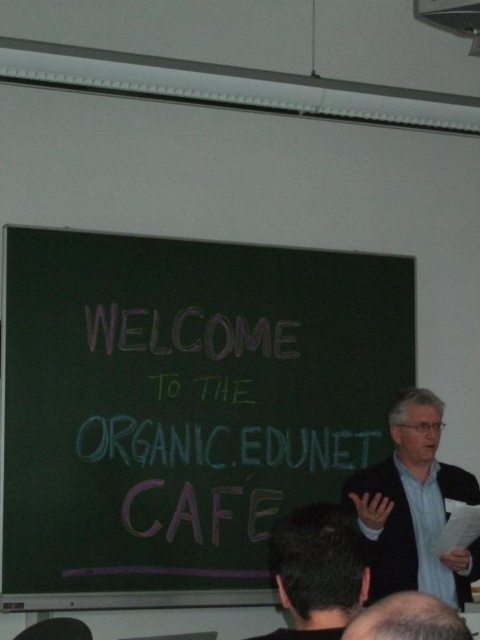
Question: Considering the relative positions of chalkboard at center and dark gray hair at lower center in the image provided, where is chalkboard at center located with respect to dark gray hair at lower center?

Choices:
 (A) below
 (B) above

Answer: (B)

Question: In this image, where is chalkboard at center located relative to dark gray hair at upper center?

Choices:
 (A) left
 (B) right

Answer: (A)

Question: Which of the following is the farthest from the observer?

Choices:
 (A) (352, 564)
 (B) (222, 317)
 (C) (447, 564)

Answer: (B)

Question: Which point appears closest to the camera in this image?

Choices:
 (A) (430, 400)
 (B) (180, 401)
 (C) (286, 608)
 (D) (455, 625)

Answer: (D)

Question: Can you confirm if dark gray hair at upper center is thinner than dark gray hair at lower center?

Choices:
 (A) no
 (B) yes

Answer: (A)

Question: Which of the following is the closest to the observer?

Choices:
 (A) (422, 612)
 (B) (310, 609)

Answer: (A)